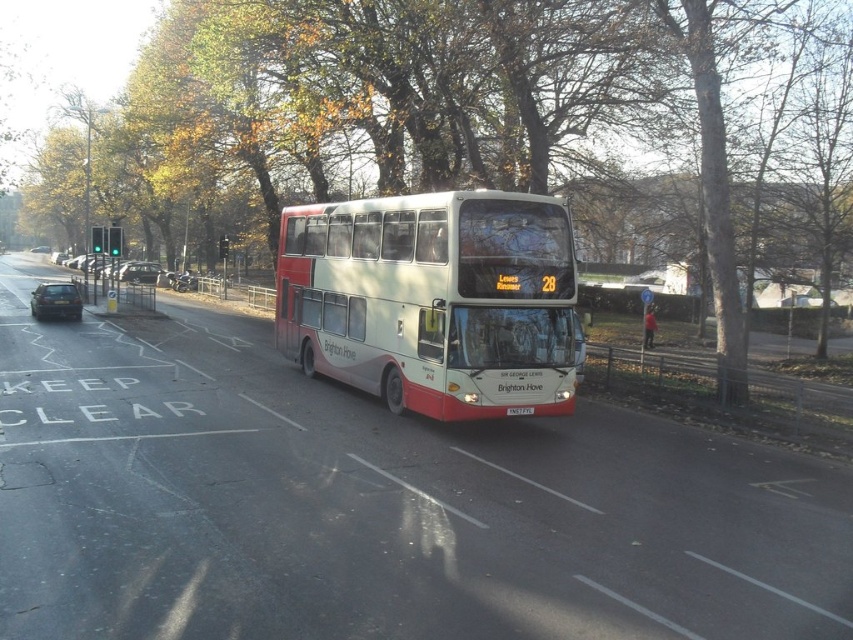
Question: Considering the relative positions of white matte double-decker bus at center and metallic silver car at center-left in the image provided, where is white matte double-decker bus at center located with respect to metallic silver car at center-left?

Choices:
 (A) above
 (B) below

Answer: (B)

Question: Can you confirm if metallic silver car at left is smaller than white plastic license plate at center?

Choices:
 (A) yes
 (B) no

Answer: (B)

Question: Which point is closer to the camera?

Choices:
 (A) (151, 273)
 (B) (410, 381)

Answer: (B)

Question: Which of the following is the closest to the observer?

Choices:
 (A) metallic silver car at center-left
 (B) metallic silver car at left
 (C) white plastic license plate at center
 (D) green leafy tree at center

Answer: (D)

Question: Observing the image, what is the correct spatial positioning of metallic silver car at center-left in reference to white plastic license plate at center?

Choices:
 (A) below
 (B) above

Answer: (B)

Question: Estimate the real-world distances between objects in this image. Which object is closer to the metallic silver car at center-left?

Choices:
 (A) green leafy tree at center
 (B) white plastic license plate at center

Answer: (A)